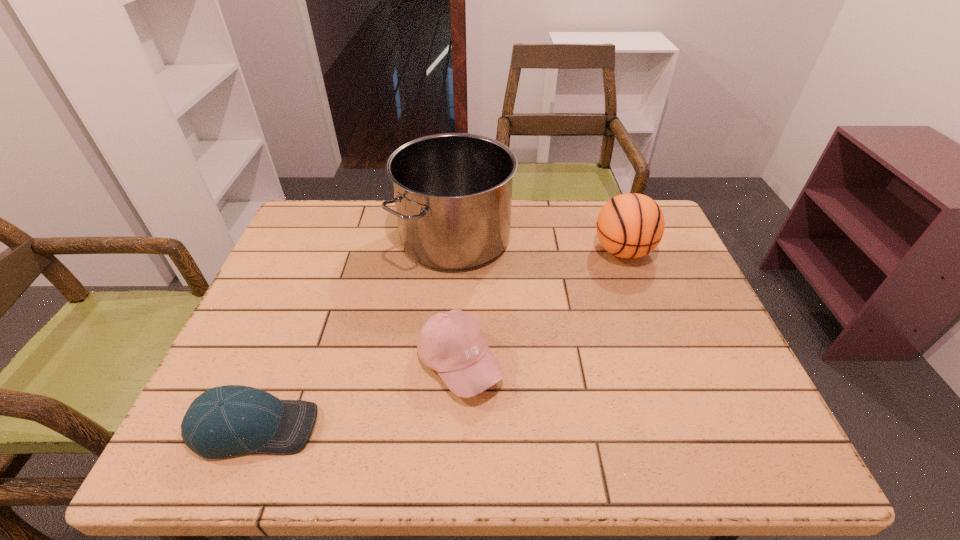
This screenshot has width=960, height=540. In the image, there is a desktop. Identify the location of free space at the right edge. (734, 364).

Where is `free spot at the far left corner of the desktop`? free spot at the far left corner of the desktop is located at coordinates (341, 224).

At what (x,y) coordinates should I click in order to perform the action: click on free space between the shorter baseball cap and the tallest object. Please return your answer as a coordinate pair (x, y). This screenshot has width=960, height=540. Looking at the image, I should click on (355, 333).

You are a GUI agent. You are given a task and a screenshot of the screen. Output one action in this format:
    pyautogui.click(x=<x>, y=<y>)
    Task: Click on the vacant space that's between the second shortest object and the basketball
    The image size is (960, 540).
    Given the screenshot: What is the action you would take?
    pyautogui.click(x=541, y=307)

Locate an element on the screen. This screenshot has height=540, width=960. vacant area that lies between the rightmost object and the taller baseball cap is located at coordinates (541, 307).

Where is `vacant space that is in between the right baseball cap and the basketball`? The width and height of the screenshot is (960, 540). vacant space that is in between the right baseball cap and the basketball is located at coordinates (541, 307).

Where is `vacant region between the shortest object and the right baseball cap`? vacant region between the shortest object and the right baseball cap is located at coordinates (357, 395).

Find the location of a particular element. The image size is (960, 540). free space between the shorter baseball cap and the right baseball cap is located at coordinates (357, 395).

Find the location of a particular element. vacant area that lies between the saucepan and the basketball is located at coordinates (539, 244).

This screenshot has width=960, height=540. What are the coordinates of `vacant area between the right baseball cap and the leftmost object` in the screenshot? It's located at (357, 395).